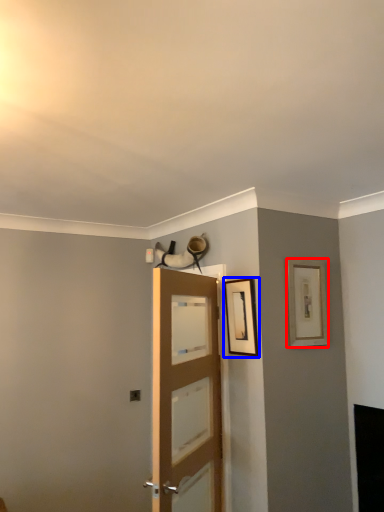
Question: Which of the following is the closest to the observer, picture frame (highlighted by a red box) or picture frame (highlighted by a blue box)?

Choices:
 (A) picture frame
 (B) picture frame

Answer: (B)